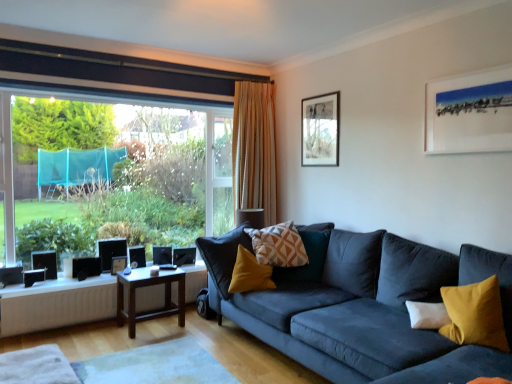
Question: Is matte white picture frame at upper right, the third picture frame positioned from the left, outside black plastic speaker at lower left, the 3th speaker when ordered from right to left?

Choices:
 (A) yes
 (B) no

Answer: (A)

Question: Does matte white picture frame at upper right, the third picture frame positioned from the left, lie behind black plastic speaker at lower left, arranged as the first speaker when viewed from the left?

Choices:
 (A) yes
 (B) no

Answer: (B)

Question: Is matte white picture frame at upper right, the first picture frame positioned from the front, thinner than black plastic speaker at lower left, which appears as the first speaker when viewed from the front?

Choices:
 (A) no
 (B) yes

Answer: (A)

Question: Considering the relative positions of matte white picture frame at upper right, the third picture frame positioned from the left, and black plastic speaker at lower left, which is the 3th speaker from back to front, in the image provided, is matte white picture frame at upper right, the third picture frame positioned from the left, to the right of black plastic speaker at lower left, which is the 3th speaker from back to front, from the viewer's perspective?

Choices:
 (A) no
 (B) yes

Answer: (B)

Question: From the image's perspective, does matte white picture frame at upper right, the first picture frame positioned from the front, appear lower than black plastic speaker at lower left, which appears as the first speaker when viewed from the front?

Choices:
 (A) yes
 (B) no

Answer: (B)

Question: Does matte white picture frame at upper right, the 2th picture frame in the bottom-to-top sequence, have a greater width compared to black plastic speaker at lower left, which is the 3th speaker from back to front?

Choices:
 (A) no
 (B) yes

Answer: (B)

Question: From a real-world perspective, is brown wooden table at center, the 2th table when ordered from top to bottom, over geometric-patterned fabric pillow at center, the 1th pillow when ordered from left to right?

Choices:
 (A) no
 (B) yes

Answer: (A)

Question: Considering the relative sizes of brown wooden table at center, the 2th table when ordered from top to bottom, and geometric-patterned fabric pillow at center, the 1th pillow when ordered from left to right, in the image provided, is brown wooden table at center, the 2th table when ordered from top to bottom, taller than geometric-patterned fabric pillow at center, the 1th pillow when ordered from left to right,?

Choices:
 (A) no
 (B) yes

Answer: (B)

Question: Is brown wooden table at center, the 2th table when ordered from top to bottom, to the left of geometric-patterned fabric pillow at center, the 1th pillow when ordered from left to right, from the viewer's perspective?

Choices:
 (A) no
 (B) yes

Answer: (B)

Question: Is geometric-patterned fabric pillow at center, the 1th pillow viewed from the back, at the back of brown wooden table at center, the 2th table when ordered from top to bottom?

Choices:
 (A) no
 (B) yes

Answer: (A)

Question: Is brown wooden table at center, the first table when ordered from bottom to top, further to camera compared to geometric-patterned fabric pillow at center, marked as the 2th pillow in a front-to-back arrangement?

Choices:
 (A) yes
 (B) no

Answer: (A)

Question: Can you see brown wooden table at center, the 2th table when ordered from top to bottom, touching geometric-patterned fabric pillow at center, marked as the 2th pillow in a front-to-back arrangement?

Choices:
 (A) no
 (B) yes

Answer: (A)

Question: Considering the relative sizes of white matte radiator at lower left and brown wooden table at center, the 2th table when ordered from top to bottom, in the image provided, is white matte radiator at lower left thinner than brown wooden table at center, the 2th table when ordered from top to bottom,?

Choices:
 (A) yes
 (B) no

Answer: (A)